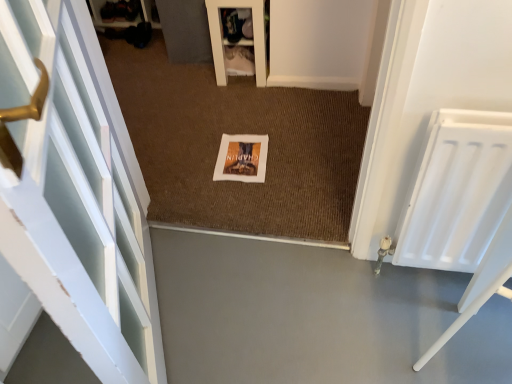
Find the location of a particular element. vacant point to the left of white matte radiator at right is located at coordinates (366, 299).